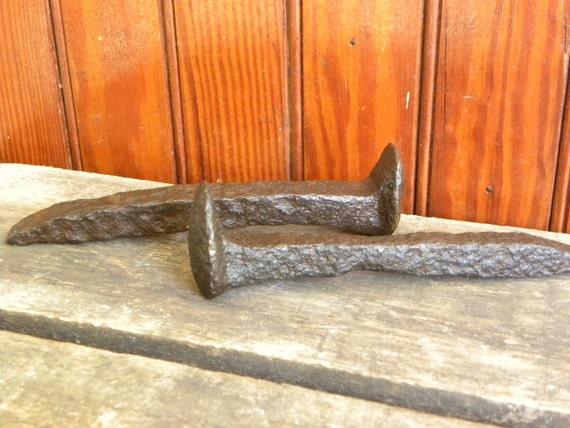
Find the location of a particular element. This screenshot has width=570, height=428. wooden panelling is located at coordinates (22, 74), (112, 59), (228, 61), (353, 50), (488, 54).